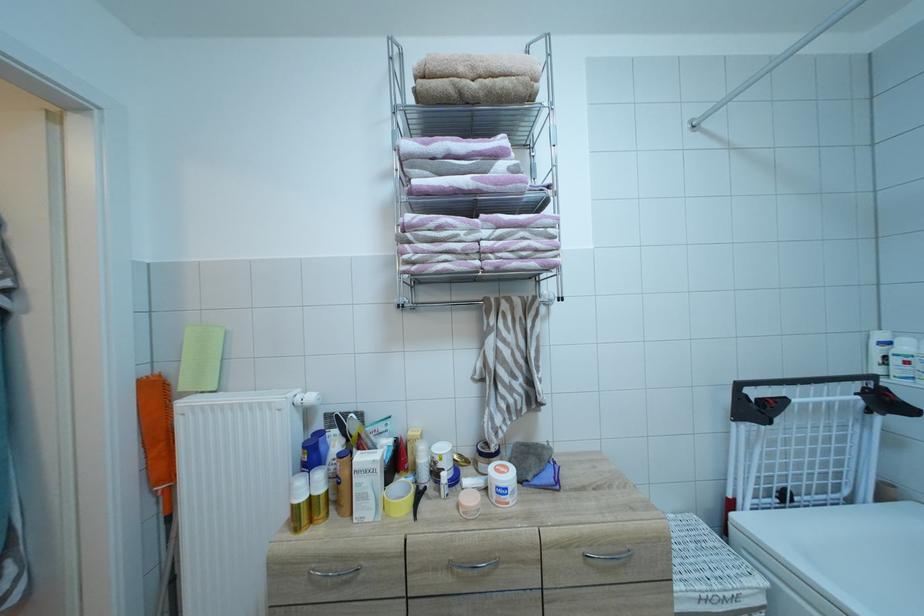
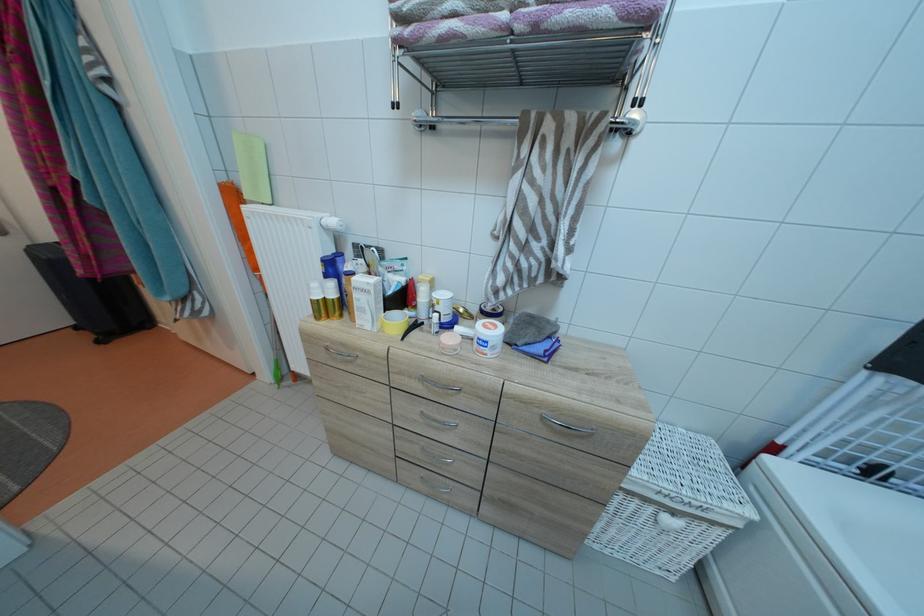
Find the pixel in the second image that matches point (329, 493) in the first image.

(341, 301)